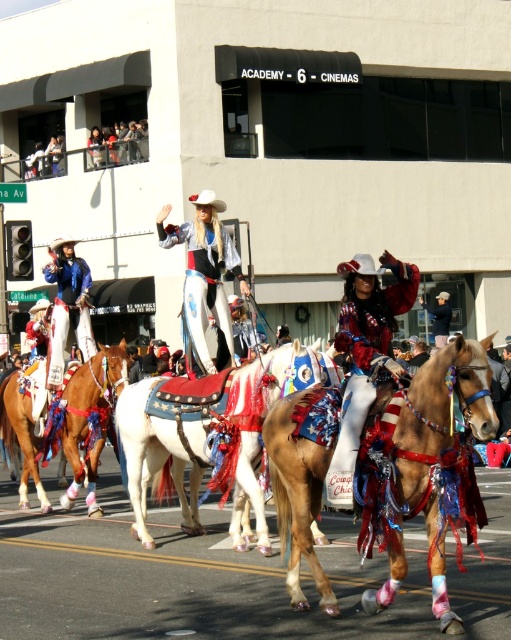
In the scene shown: Does shiny red boots at center have a lesser width compared to shiny silver cowboy hat at center?

Yes, shiny red boots at center is thinner than shiny silver cowboy hat at center.

Is shiny red boots at center positioned at the back of shiny silver cowboy hat at center?

No, shiny red boots at center is closer to the viewer.

Is point (383, 349) behind point (190, 333)?

No, it is in front of (190, 333).

Identify the location of shiny red boots at center. This screenshot has height=640, width=511. (364, 353).

Which is more to the left, shiny red boots at center or smooth leather hat at center?

shiny red boots at center is more to the left.

What do you see at coordinates (364, 353) in the screenshot? This screenshot has height=640, width=511. I see `shiny red boots at center` at bounding box center [364, 353].

I want to click on shiny red boots at center, so click(364, 353).

Who is positioned more to the left, shiny brown horse at center or shiny silver cowboy hat at center?

Result: shiny silver cowboy hat at center is more to the left.

Which is behind, point (428, 396) or point (193, 275)?

The point (193, 275) is behind.

The height and width of the screenshot is (640, 511). Describe the element at coordinates (428, 456) in the screenshot. I see `shiny brown horse at center` at that location.

Where is `shiny brown horse at center`? The image size is (511, 640). shiny brown horse at center is located at coordinates (428, 456).